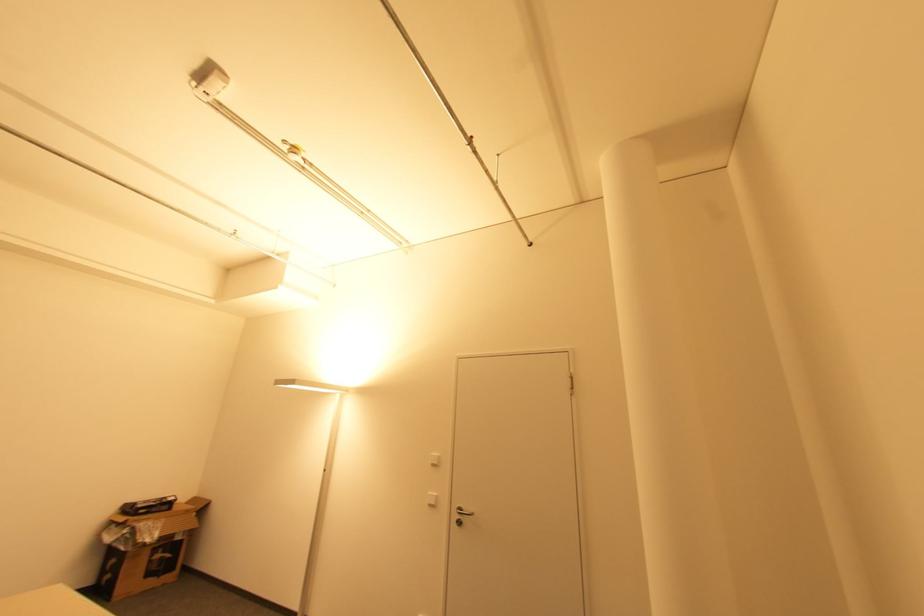
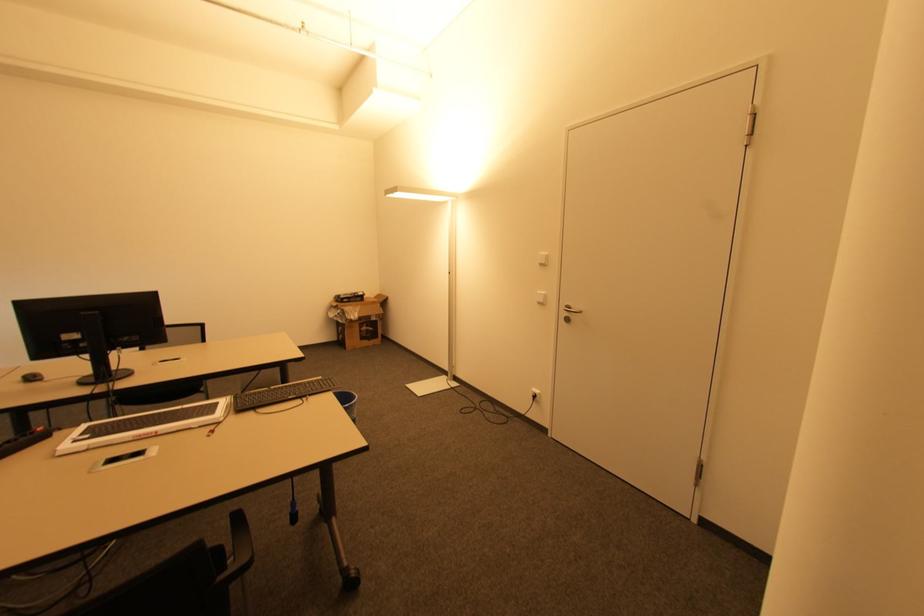
In the second image, find the point that corresponds to point (164, 559) in the first image.

(369, 331)